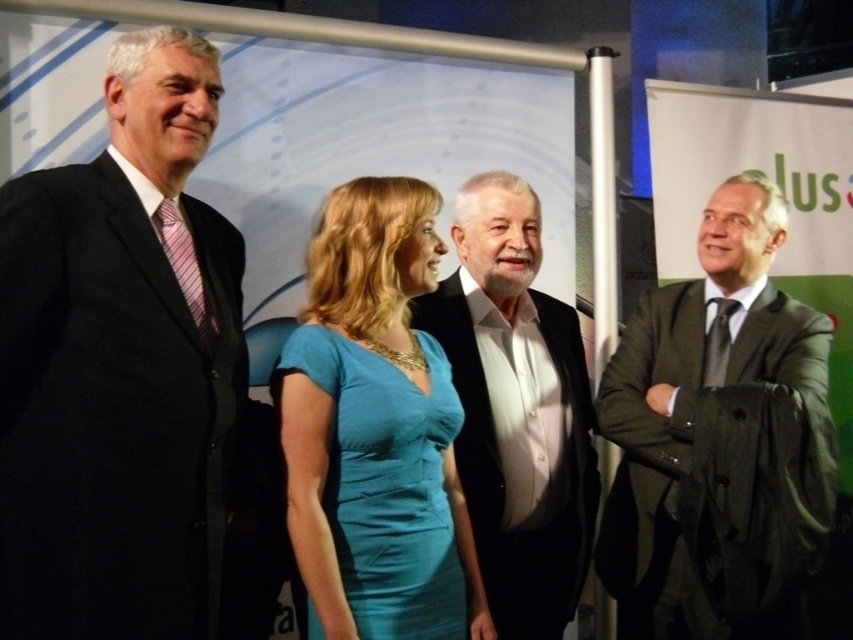
Does black suit at left have a larger size compared to teal satin dress at center?

Yes, black suit at left is bigger than teal satin dress at center.

The image size is (853, 640). Identify the location of black suit at left. (120, 365).

Is point (30, 321) closer to viewer compared to point (352, 595)?

Yes.

Where is `black suit at left`? This screenshot has width=853, height=640. black suit at left is located at coordinates (120, 365).

Does point (196, 268) come farther from viewer compared to point (506, 372)?

No, it is in front of (506, 372).

Is black suit at left to the left of white matte suit at center from the viewer's perspective?

Indeed, black suit at left is positioned on the left side of white matte suit at center.

Is point (91, 257) farther from camera compared to point (554, 502)?

No, it is in front of (554, 502).

The width and height of the screenshot is (853, 640). I want to click on black suit at left, so coord(120,365).

Where is `black suit at left`? This screenshot has height=640, width=853. black suit at left is located at coordinates (120, 365).

Which is more to the right, black suit at left or dark gray suit at right?

Positioned to the right is dark gray suit at right.

What do you see at coordinates (120, 365) in the screenshot? I see `black suit at left` at bounding box center [120, 365].

The height and width of the screenshot is (640, 853). In order to click on black suit at left in this screenshot , I will do `click(120, 365)`.